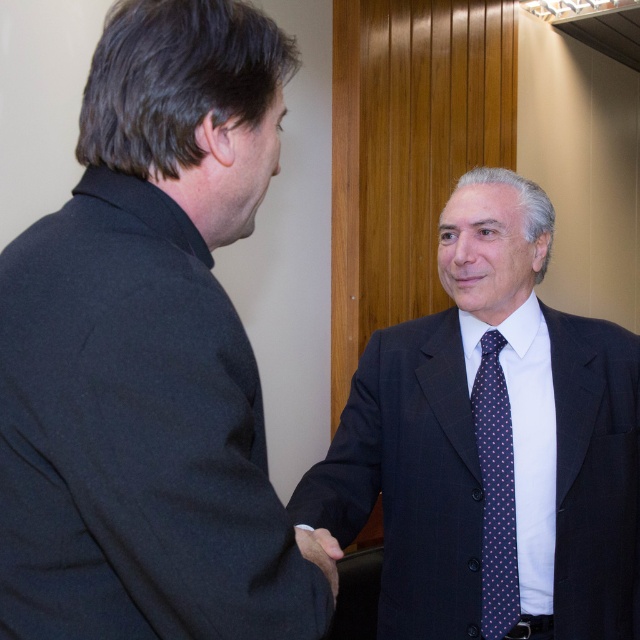
Question: Which object is the closest to the black wool suit at left?

Choices:
 (A) dark blue suit at center
 (B) dark blue dotted tie at right

Answer: (A)

Question: Which object is the closest to the dark brown leather hand at center?

Choices:
 (A) dark blue dotted tie at right
 (B) dark blue suit at center
 (C) black wool suit at left

Answer: (C)

Question: Is dark blue suit at center below dark brown leather hand at center?

Choices:
 (A) no
 (B) yes

Answer: (A)

Question: Can you confirm if dark blue dotted tie at right is positioned below dark brown leather hand at center?

Choices:
 (A) no
 (B) yes

Answer: (A)

Question: Among these points, which one is farthest from the camera?

Choices:
 (A) (337, 589)
 (B) (470, 550)
 (C) (45, 429)

Answer: (B)

Question: Observing the image, what is the correct spatial positioning of dark blue suit at center in reference to dark brown leather hand at center?

Choices:
 (A) above
 (B) below

Answer: (A)